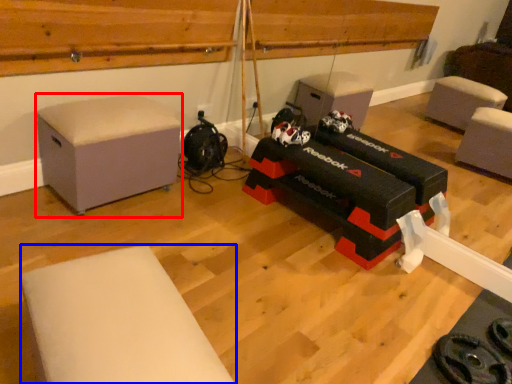
Question: Which point is further to the camera, furniture (highlighted by a red box) or furniture (highlighted by a blue box)?

Choices:
 (A) furniture
 (B) furniture

Answer: (A)